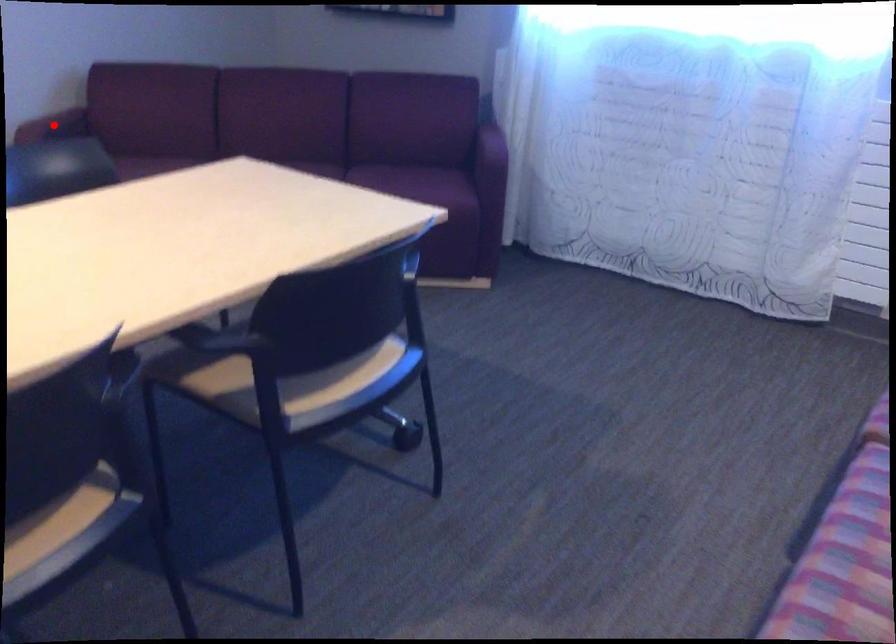
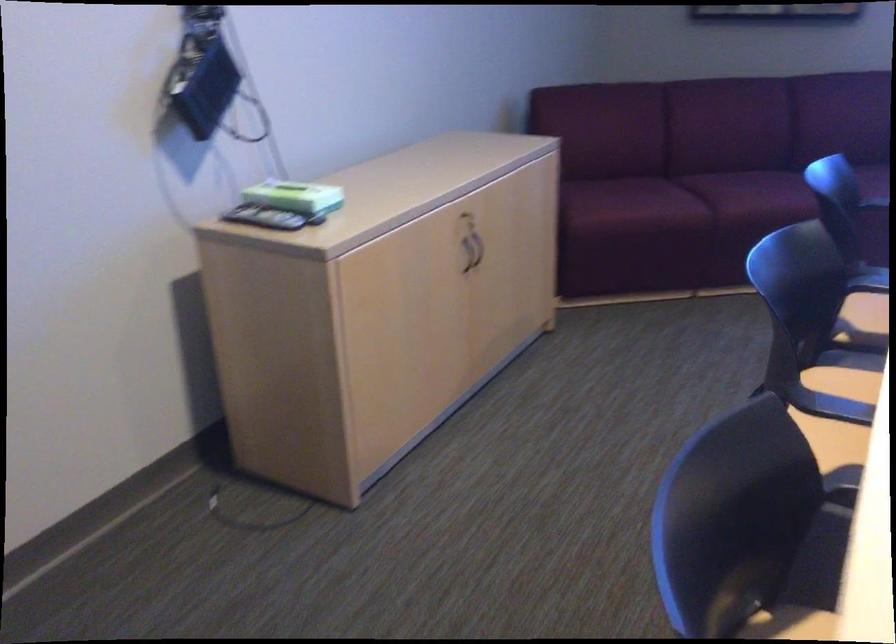
Question: I am providing you with two images of the same scene from different viewpoints. A red point is marked on the first image. Is the red point's position out of view in image 2?

Choices:
 (A) Yes
 (B) No

Answer: (A)